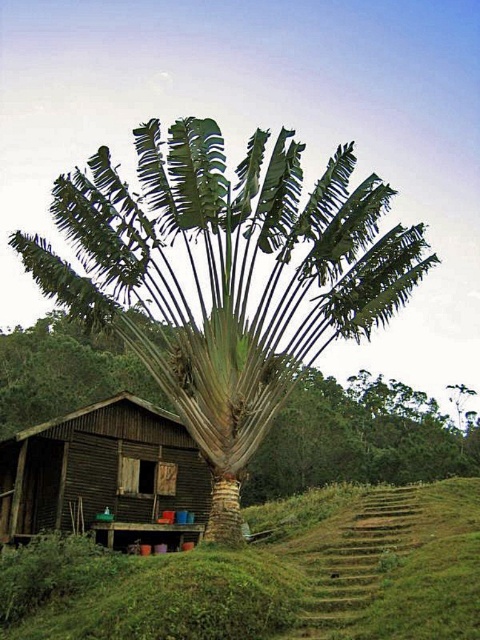
Between green leafy palm at center and brown wooden hut at lower left, which one is positioned higher?

brown wooden hut at lower left is higher up.

Can you confirm if green leafy palm at center is taller than brown wooden hut at lower left?

Correct, green leafy palm at center is much taller as brown wooden hut at lower left.

Who is more distant from viewer, (x=312, y=449) or (x=90, y=483)?

Positioned behind is point (x=312, y=449).

Locate an element on the screen. The height and width of the screenshot is (640, 480). green leafy palm at center is located at coordinates click(359, 436).

Can you confirm if green leafy banana tree at center is bigger than brown wooden hut at lower left?

Yes, green leafy banana tree at center is bigger than brown wooden hut at lower left.

Between point (220, 275) and point (103, 433), which one is positioned in front?

Point (220, 275) is more forward.

Locate an element on the screen. This screenshot has height=640, width=480. green leafy banana tree at center is located at coordinates (226, 276).

Can you confirm if green leafy banana tree at center is wider than green leafy palm at center?

No, green leafy banana tree at center is not wider than green leafy palm at center.

In the scene shown: Who is more forward, (240, 403) or (300, 460)?

Point (240, 403) is more forward.

Find the location of `green leafy banana tree at center`. green leafy banana tree at center is located at coordinates (226, 276).